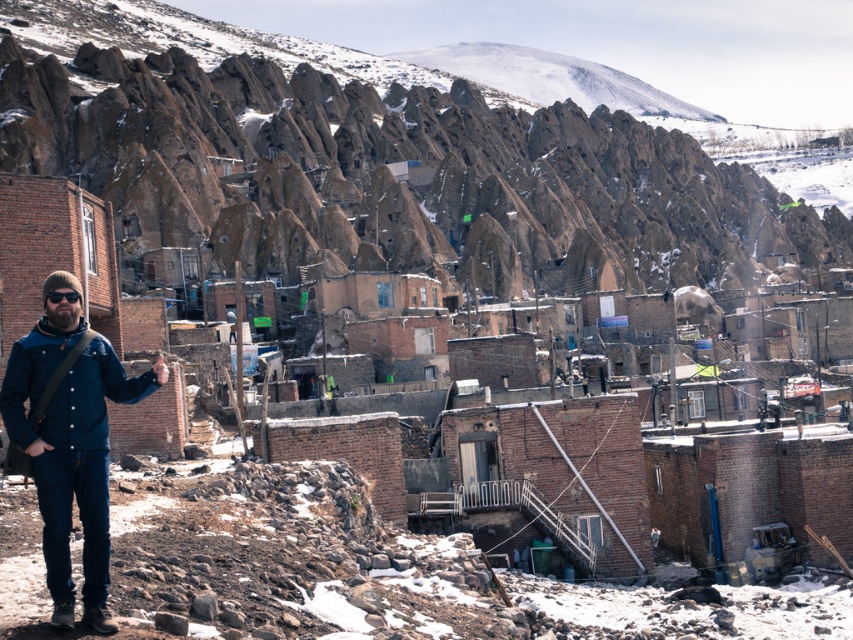
Question: Which point is farther to the camera?

Choices:
 (A) blue denim jacket at lower left
 (B) brown rocky mountain at upper center

Answer: (B)

Question: Among these objects, which one is farthest from the camera?

Choices:
 (A) blue denim jacket at lower left
 (B) brown rocky mountain at upper center

Answer: (B)

Question: Can you confirm if brown rocky mountain at upper center is positioned to the left of blue denim jacket at lower left?

Choices:
 (A) no
 (B) yes

Answer: (A)

Question: Observing the image, what is the correct spatial positioning of brown rocky mountain at upper center in reference to blue denim jacket at lower left?

Choices:
 (A) above
 (B) below

Answer: (A)

Question: Which object appears farthest from the camera in this image?

Choices:
 (A) brown rocky mountain at upper center
 (B) blue denim jacket at lower left

Answer: (A)

Question: Does brown rocky mountain at upper center lie behind blue denim jacket at lower left?

Choices:
 (A) yes
 (B) no

Answer: (A)